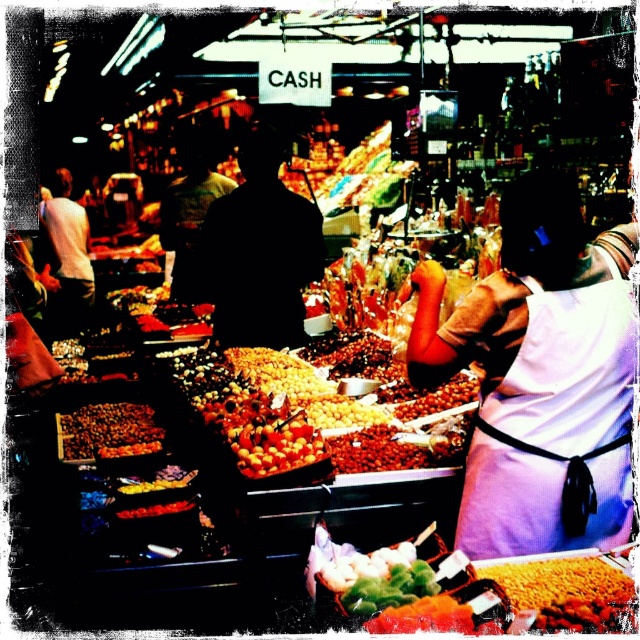
Question: Which of the following is the closest to the observer?

Choices:
 (A) (276, 432)
 (B) (486, 467)

Answer: (B)

Question: Which object is the closest to the purple fabric apron at right?

Choices:
 (A) shiny yellow fruit at center
 (B) shiny brown nuts at center
 (C) white shirt at left

Answer: (A)

Question: Is black matte figure at center positioned at the back of silhouette figure at center?

Choices:
 (A) no
 (B) yes

Answer: (A)

Question: Can you confirm if black matte figure at center is positioned to the right of silhouette figure at center?

Choices:
 (A) no
 (B) yes

Answer: (B)

Question: Based on their relative distances, which object is farther from the black matte figure at center?

Choices:
 (A) shiny yellow fruit at center
 (B) white shirt at left
 (C) shiny brown nuts at center
 (D) purple fabric apron at right

Answer: (B)

Question: Where is silhouette figure at center located in relation to shiny yellow fruit at center in the image?

Choices:
 (A) right
 (B) left

Answer: (B)